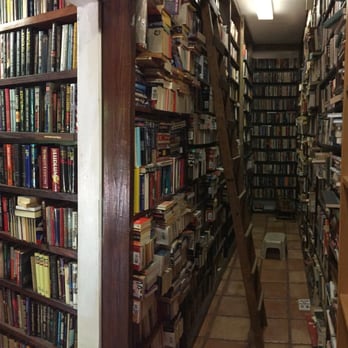
I want to click on chair, so tap(285, 205).